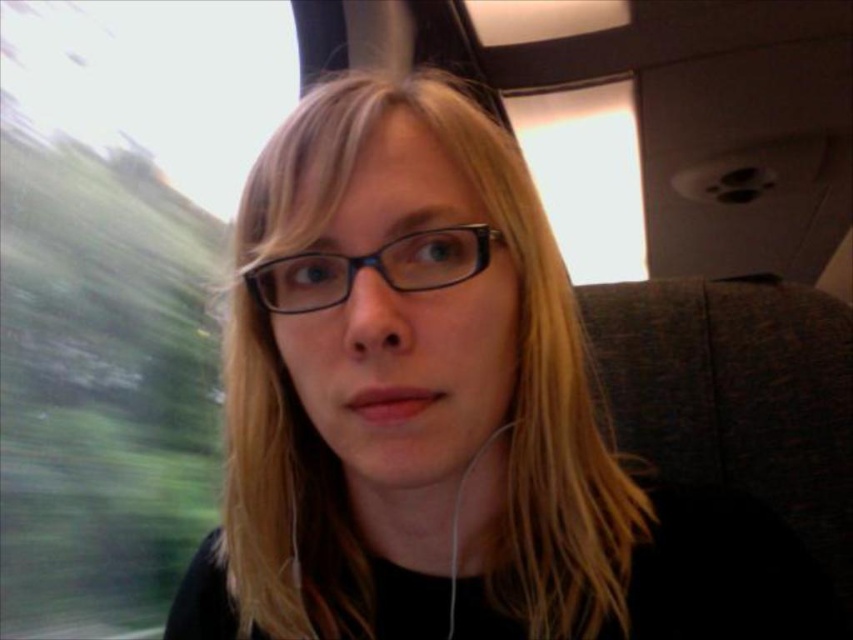
Question: Is blonde hair at center above white matte earphone at lower center?

Choices:
 (A) no
 (B) yes

Answer: (B)

Question: Which of the following is the farthest from the observer?

Choices:
 (A) blue plastic glasses at center
 (B) blonde hair at center

Answer: (B)

Question: Which point is farther from the camera taking this photo?

Choices:
 (A) 393,280
 (B) 457,564

Answer: (B)

Question: Is blonde hair at center behind blue plastic glasses at center?

Choices:
 (A) no
 (B) yes

Answer: (B)

Question: Does blonde hair at center have a greater width compared to white matte earphone at lower center?

Choices:
 (A) yes
 (B) no

Answer: (A)

Question: Estimate the real-world distances between objects in this image. Which object is farther from the blue plastic glasses at center?

Choices:
 (A) blonde hair at center
 (B) white matte earphone at lower center

Answer: (B)